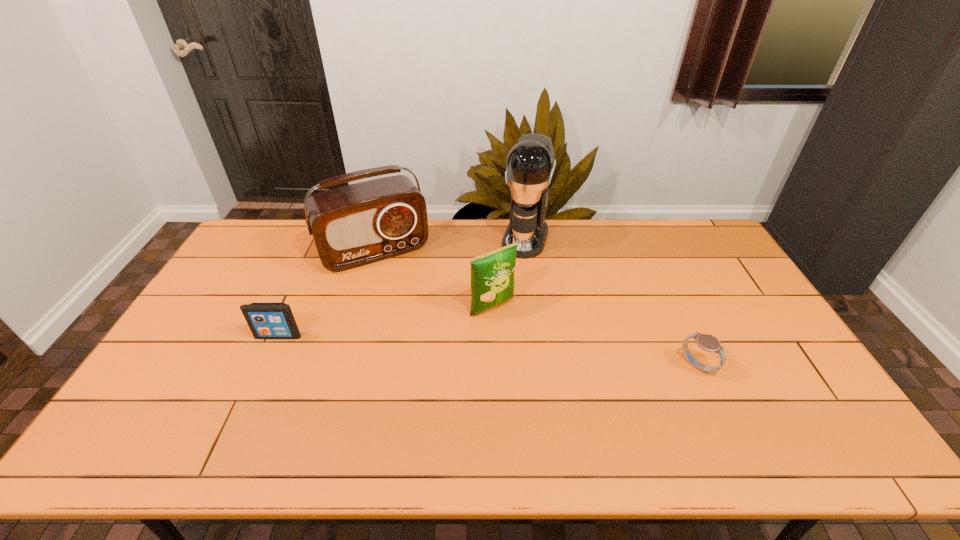
Image resolution: width=960 pixels, height=540 pixels. Identify the location of radio receiver situated at the far edge. [354, 225].

Where is `vacant point at the far edge`? Image resolution: width=960 pixels, height=540 pixels. vacant point at the far edge is located at coordinates (458, 228).

Image resolution: width=960 pixels, height=540 pixels. In the image, there is a desktop. Find the location of `vacant space at the near edge`. vacant space at the near edge is located at coordinates (569, 394).

Identify the location of vacant space at the left edge. (220, 330).

Identify the location of vacant space at the right edge. This screenshot has width=960, height=540. (771, 358).

This screenshot has height=540, width=960. I want to click on free point at the far left corner, so click(269, 241).

In the image, there is a desktop. At what (x,y) coordinates should I click in order to perform the action: click on vacant space at the far right corner. Please return your answer as a coordinate pair (x, y). The width and height of the screenshot is (960, 540). Looking at the image, I should click on (679, 236).

Locate an element on the screen. This screenshot has height=540, width=960. free space between the crisp (potato chip) and the iPod is located at coordinates (386, 322).

Where is `free area in between the nearest object and the fourth tallest object`? This screenshot has width=960, height=540. free area in between the nearest object and the fourth tallest object is located at coordinates (488, 351).

Where is `empty space that is in between the tallest object and the fourth shortest object`? This screenshot has width=960, height=540. empty space that is in between the tallest object and the fourth shortest object is located at coordinates (450, 245).